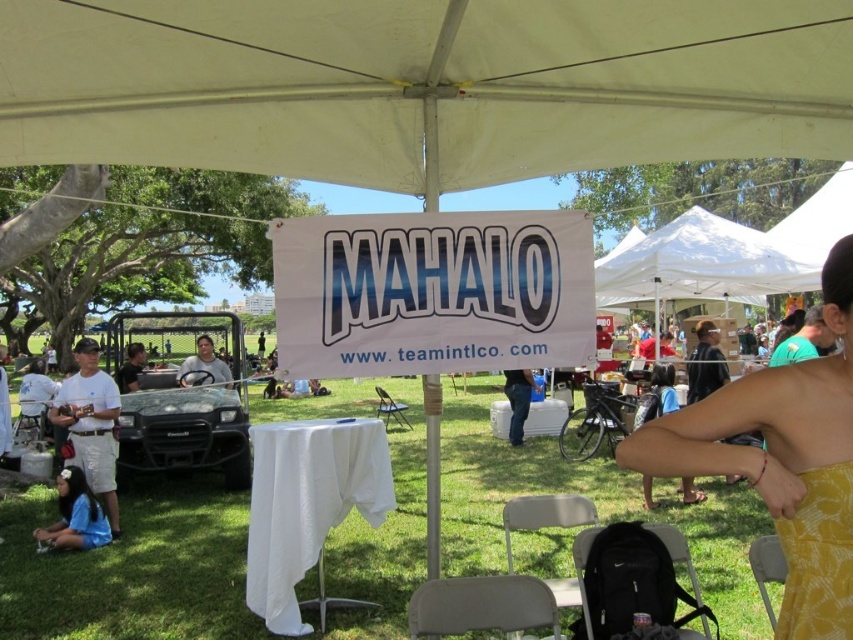
You are standing at the point labeled as point (x=782, y=460) in the image. What object is located at this specific coordinate?

The point (x=782, y=460) corresponds to the yellow dress at center.

You are attending an outdoor event under a large white canopy tent and see two yellow dresses. The first is the yellow dress at center and the second is the yellow printed dress at lower right. Which one is positioned to the left of the other?

The yellow dress at center is positioned to the left of the yellow printed dress at lower right.